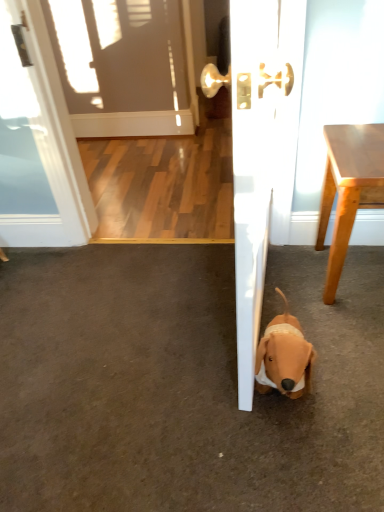
Question: Is light brown wood table at right positioned far away from brown plush dog at lower right?

Choices:
 (A) no
 (B) yes

Answer: (A)

Question: Can you confirm if light brown wood table at right is shorter than brown plush dog at lower right?

Choices:
 (A) no
 (B) yes

Answer: (A)

Question: Can you confirm if light brown wood table at right is taller than brown plush dog at lower right?

Choices:
 (A) yes
 (B) no

Answer: (A)

Question: Is light brown wood table at right closer to camera compared to brown plush dog at lower right?

Choices:
 (A) yes
 (B) no

Answer: (B)

Question: Is light brown wood table at right aimed at brown plush dog at lower right?

Choices:
 (A) no
 (B) yes

Answer: (A)

Question: In the image, is light brown wood table at right positioned in front of or behind white glossy door at center?

Choices:
 (A) front
 (B) behind

Answer: (B)

Question: From the image's perspective, is light brown wood table at right positioned above or below white glossy door at center?

Choices:
 (A) below
 (B) above

Answer: (A)

Question: In the image, is light brown wood table at right on the left side or the right side of white glossy door at center?

Choices:
 (A) left
 (B) right

Answer: (B)

Question: From a real-world perspective, is light brown wood table at right physically located above or below white glossy door at center?

Choices:
 (A) above
 (B) below

Answer: (B)

Question: Based on their positions, is light brown wood table at right located to the left or right of brown plush dog at lower right?

Choices:
 (A) right
 (B) left

Answer: (A)

Question: From a real-world perspective, relative to brown plush dog at lower right, is light brown wood table at right vertically above or below?

Choices:
 (A) below
 (B) above

Answer: (B)

Question: Would you say light brown wood table at right is inside or outside brown plush dog at lower right?

Choices:
 (A) outside
 (B) inside

Answer: (A)

Question: From their relative heights in the image, would you say light brown wood table at right is taller or shorter than brown plush dog at lower right?

Choices:
 (A) tall
 (B) short

Answer: (A)

Question: From a real-world perspective, is brown plush dog at lower right above or below white glossy door at center?

Choices:
 (A) below
 (B) above

Answer: (A)

Question: Choose the correct answer: Is brown plush dog at lower right inside white glossy door at center or outside it?

Choices:
 (A) inside
 (B) outside

Answer: (B)